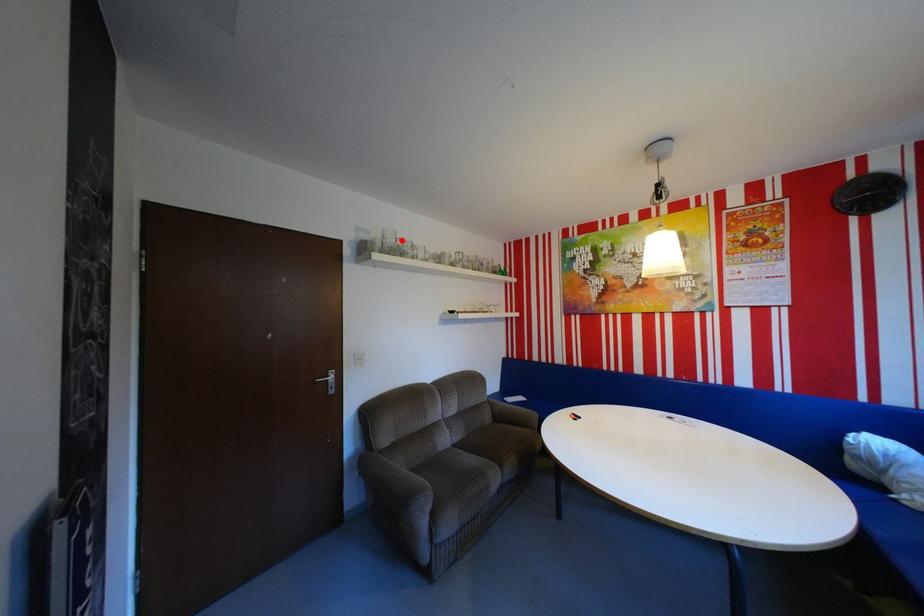
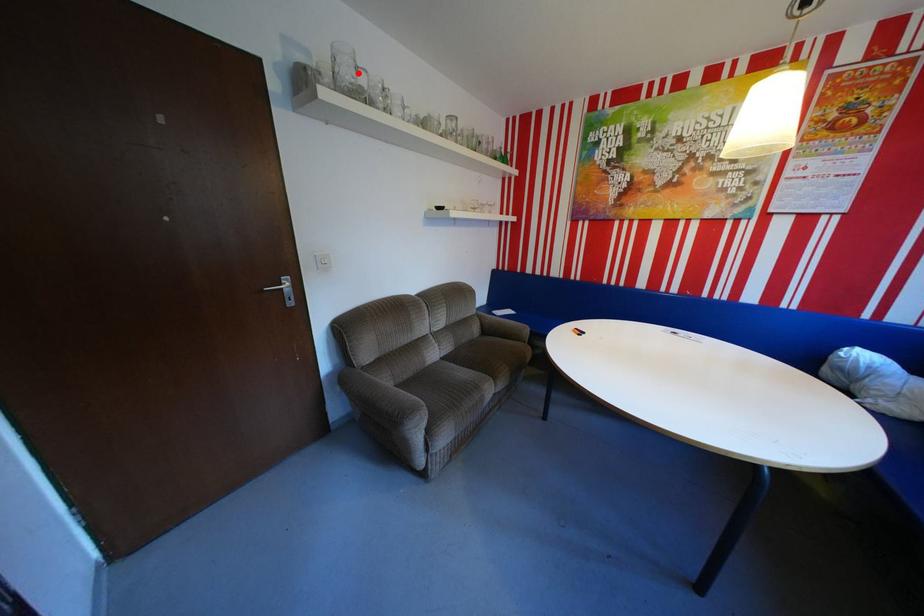
I am providing you with two images of the same scene from different viewpoints. A red point is marked on the first image and another point is marked on the second image. Do the highlighted points in image1 and image2 indicate the same real-world spot?

Yes